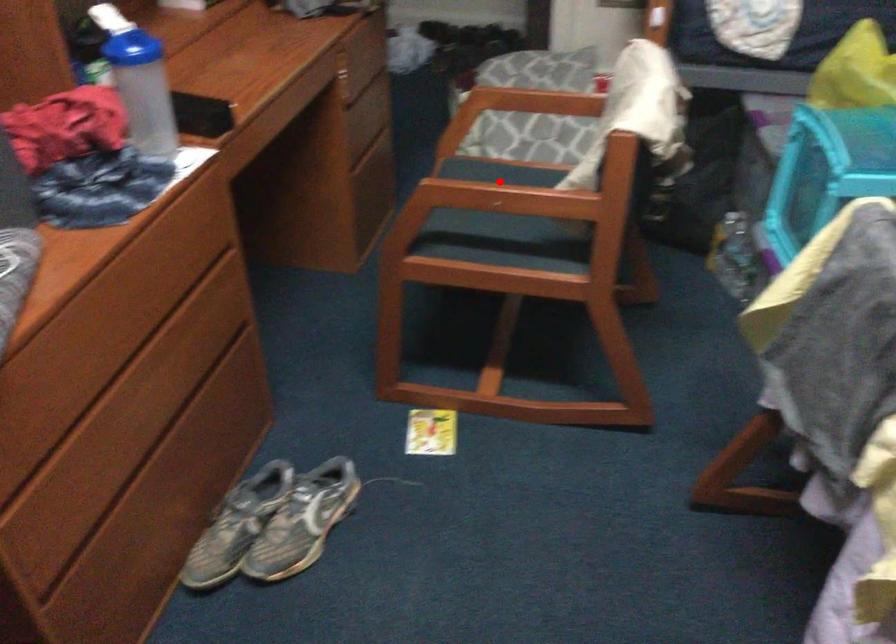
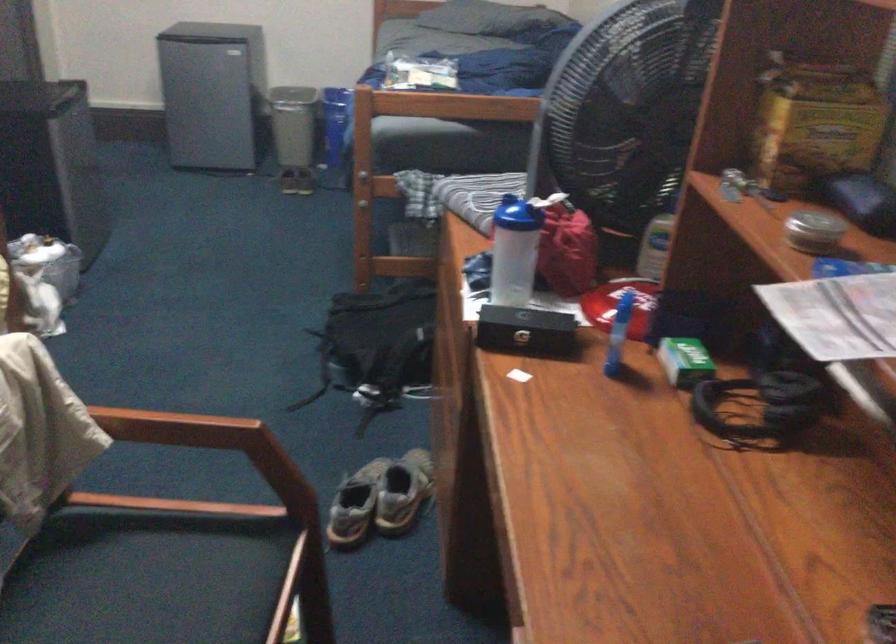
Question: I am providing you with two images of the same scene from different viewpoints. In image1, a red point is highlighted. Considering the same 3D point in image2, which of the following is correct?

Choices:
 (A) It is closer
 (B) It is farther

Answer: (A)